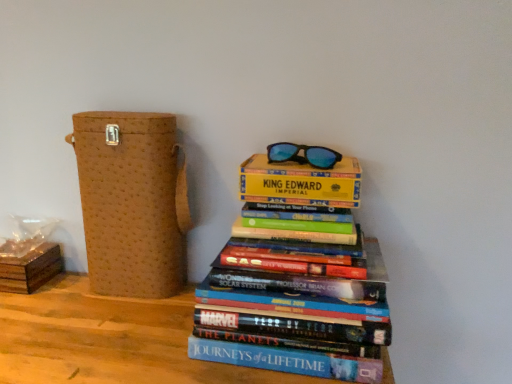
Question: Should I look upward or downward to see brown textured box at left, the second cardboard box in the left-to-right sequence?

Choices:
 (A) down
 (B) up

Answer: (A)

Question: From the image's perspective, is brown cardboard box at lower left, which is counted as the 1th cardboard box, starting from the left, located beneath hardcover books at center?

Choices:
 (A) no
 (B) yes

Answer: (B)

Question: Is the surface of brown cardboard box at lower left, the 2th cardboard box from the right, in direct contact with hardcover books at center?

Choices:
 (A) no
 (B) yes

Answer: (A)

Question: From a real-world perspective, is brown cardboard box at lower left, which is counted as the 1th cardboard box, starting from the left, physically below hardcover books at center?

Choices:
 (A) yes
 (B) no

Answer: (A)

Question: From a real-world perspective, is brown cardboard box at lower left, the 2th cardboard box from the right, over hardcover books at center?

Choices:
 (A) yes
 (B) no

Answer: (B)

Question: Is the depth of brown cardboard box at lower left, the 2th cardboard box from the right, greater than that of hardcover books at center?

Choices:
 (A) no
 (B) yes

Answer: (B)

Question: Considering the relative sizes of brown cardboard box at lower left, the 2th cardboard box from the right, and hardcover books at center in the image provided, is brown cardboard box at lower left, the 2th cardboard box from the right, smaller than hardcover books at center?

Choices:
 (A) yes
 (B) no

Answer: (A)

Question: Considering the relative sizes of brown cardboard box at lower left, the 2th cardboard box from the right, and brown textured box at left, the second cardboard box in the left-to-right sequence, in the image provided, is brown cardboard box at lower left, the 2th cardboard box from the right, bigger than brown textured box at left, the second cardboard box in the left-to-right sequence,?

Choices:
 (A) no
 (B) yes

Answer: (A)

Question: From a real-world perspective, does brown cardboard box at lower left, which is counted as the 1th cardboard box, starting from the left, stand above brown textured box at left, the second cardboard box in the left-to-right sequence?

Choices:
 (A) no
 (B) yes

Answer: (A)

Question: Is the position of brown cardboard box at lower left, the 2th cardboard box from the right, less distant than that of brown textured box at left, the second cardboard box in the left-to-right sequence?

Choices:
 (A) yes
 (B) no

Answer: (B)

Question: Is brown cardboard box at lower left, which is counted as the 1th cardboard box, starting from the left, at the left side of brown textured box at left, the second cardboard box in the left-to-right sequence?

Choices:
 (A) no
 (B) yes

Answer: (B)

Question: Is the surface of brown cardboard box at lower left, which is counted as the 1th cardboard box, starting from the left, in direct contact with brown textured box at left, the second cardboard box in the left-to-right sequence?

Choices:
 (A) yes
 (B) no

Answer: (B)

Question: Does brown cardboard box at lower left, the 2th cardboard box from the right, have a lesser width compared to brown textured box at left, the first cardboard box from the right?

Choices:
 (A) yes
 (B) no

Answer: (B)

Question: Is the depth of brown textured box at left, the second cardboard box in the left-to-right sequence, greater than that of hardcover books at center?

Choices:
 (A) yes
 (B) no

Answer: (A)